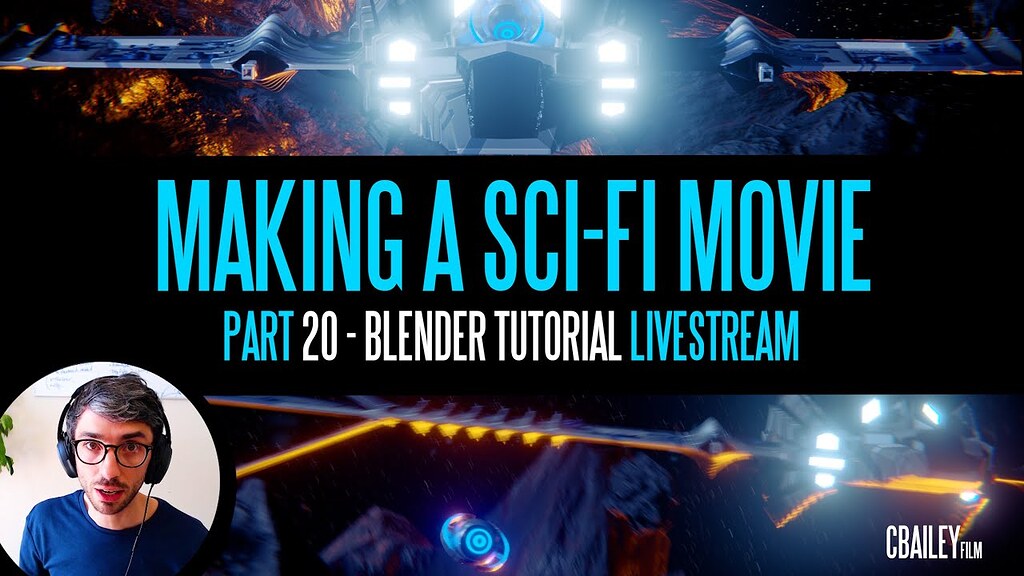
Find the location of `light beige painted wall`. light beige painted wall is located at coordinates (42, 441).